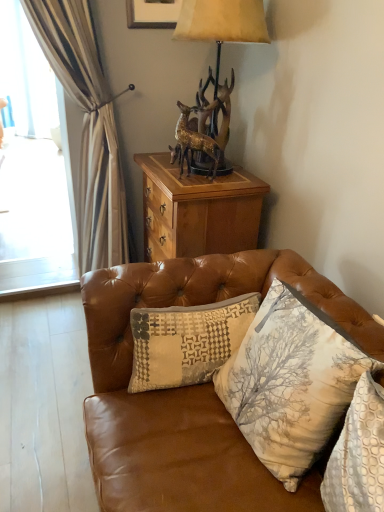
I want to click on vacant space behind gold metallic deer at center, so click(185, 172).